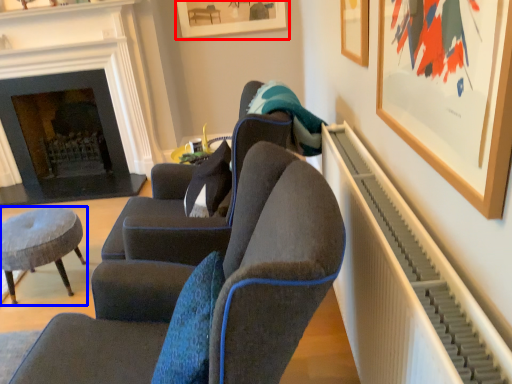
Question: Which of the following is the closest to the observer, picture frame (highlighted by a red box) or stool (highlighted by a blue box)?

Choices:
 (A) picture frame
 (B) stool

Answer: (B)